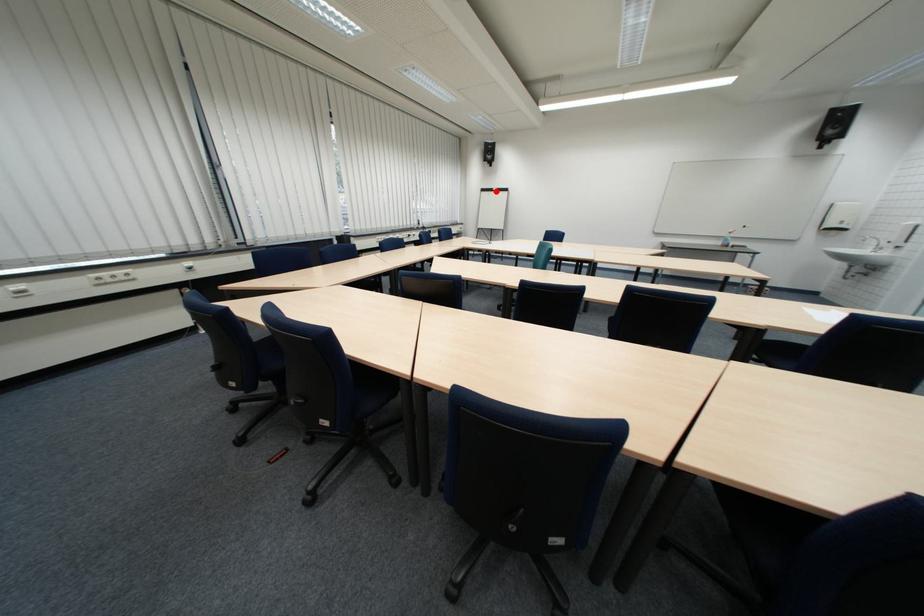
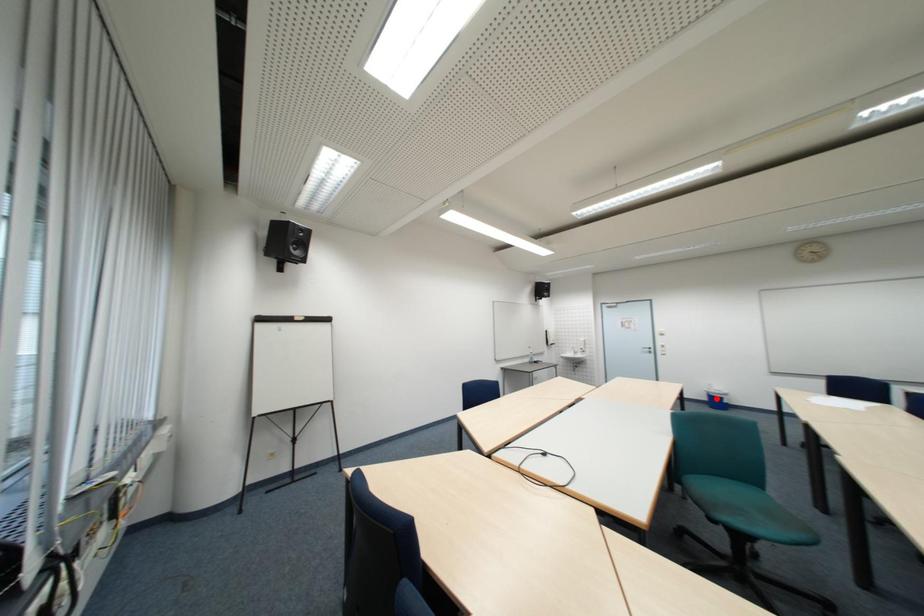
I am providing you with two images of the same scene from different viewpoints. A red point is marked on the first image and another point is marked on the second image. Do the highlighted points in image1 and image2 indicate the same real-world spot?

No